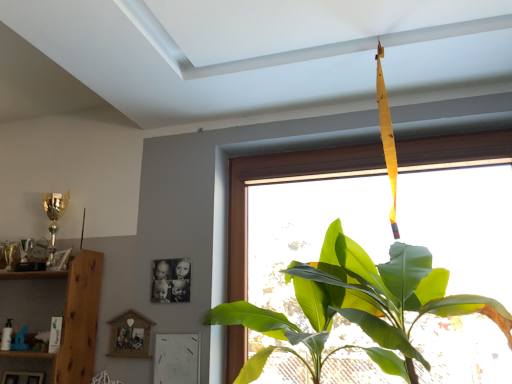
What do you see at coordinates (358, 305) in the screenshot?
I see `green leafy plant at center` at bounding box center [358, 305].

Where is `green leafy plant at center`? This screenshot has width=512, height=384. green leafy plant at center is located at coordinates (358, 305).

Identify the location of green leafy plant at center. This screenshot has width=512, height=384. (358, 305).